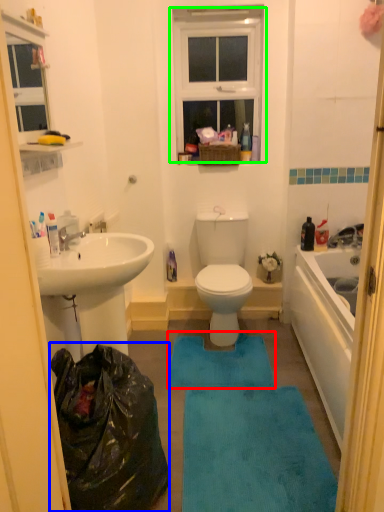
Question: Which is nearer to the bath mat (highlighted by a red box)? garbage (highlighted by a blue box) or window (highlighted by a green box).

Choices:
 (A) garbage
 (B) window

Answer: (A)